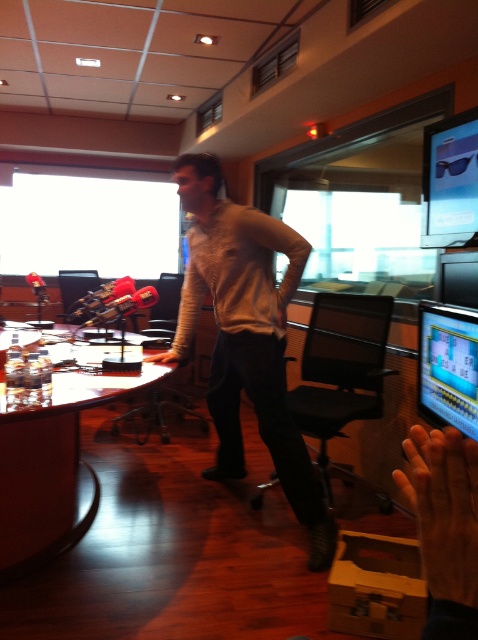
Can you confirm if light beige sweater at center is positioned below matte black monitor at right?

Actually, light beige sweater at center is above matte black monitor at right.

From the picture: Does light beige sweater at center have a smaller size compared to matte black monitor at right?

No.

The width and height of the screenshot is (478, 640). What do you see at coordinates (247, 337) in the screenshot? I see `light beige sweater at center` at bounding box center [247, 337].

This screenshot has width=478, height=640. Find the location of `light beige sweater at center`. light beige sweater at center is located at coordinates (247, 337).

Is matte black monitor at right below satin black sunglasses at upper right?

Indeed, matte black monitor at right is positioned under satin black sunglasses at upper right.

Measure the distance between point (446, 397) and camera.

The distance of point (446, 397) from camera is 1.90 meters.

Where is `matte black monitor at right`? The width and height of the screenshot is (478, 640). matte black monitor at right is located at coordinates (447, 365).

Is black mesh swivel chair at center smaller than matte black monitor at right?

Actually, black mesh swivel chair at center might be larger than matte black monitor at right.

Is black mesh swivel chair at center wider than matte black monitor at right?

Indeed, black mesh swivel chair at center has a greater width compared to matte black monitor at right.

I want to click on black mesh swivel chair at center, so click(340, 369).